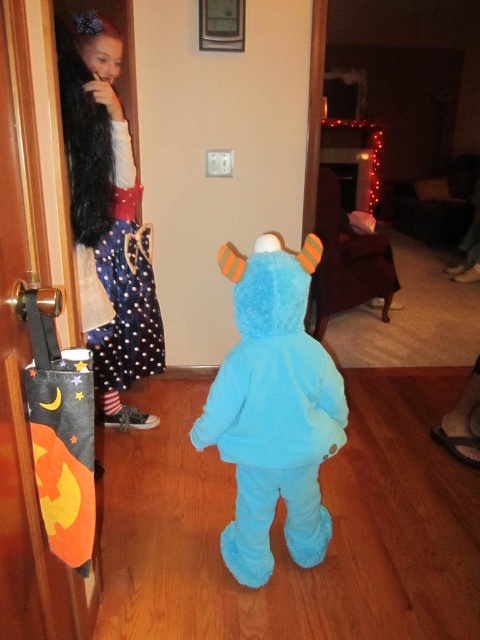
Question: Does fuzzy blue costume at center appear on the left side of polka dot fabric dress at upper left?

Choices:
 (A) yes
 (B) no

Answer: (B)

Question: Which point is closer to the camera?

Choices:
 (A) (113, 268)
 (B) (320, 250)

Answer: (B)

Question: Which object appears closest to the camera in this image?

Choices:
 (A) polka dot fabric dress at upper left
 (B) fuzzy blue costume at center

Answer: (B)

Question: Which point is farther to the camera?

Choices:
 (A) (135, 349)
 (B) (218, 419)

Answer: (A)

Question: Is fuzzy blue costume at center thinner than polka dot fabric dress at upper left?

Choices:
 (A) yes
 (B) no

Answer: (B)

Question: Does fuzzy blue costume at center appear under polka dot fabric dress at upper left?

Choices:
 (A) yes
 (B) no

Answer: (A)